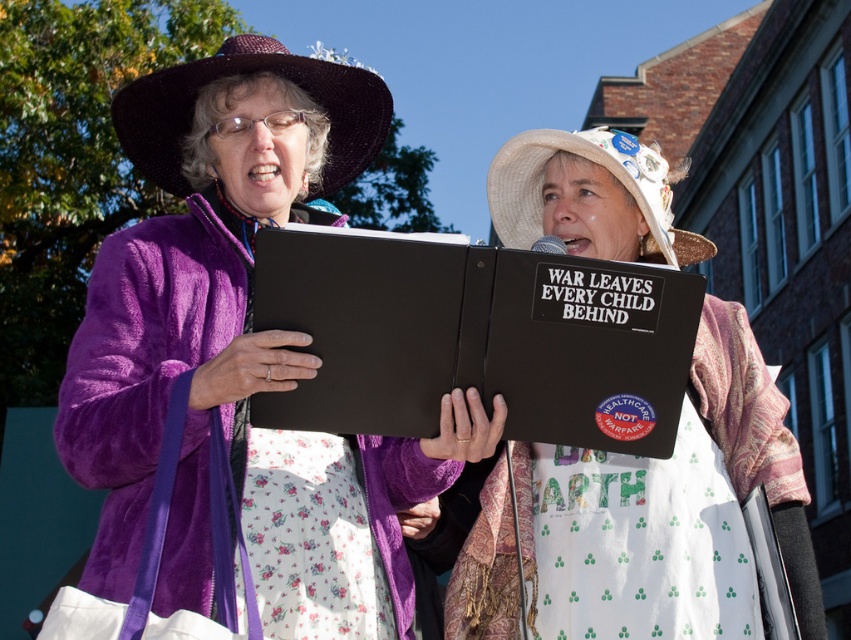
Is purple velvety jacket at center above white fabric apron at center?

Correct, purple velvety jacket at center is located above white fabric apron at center.

Between purple velvety jacket at center and white fabric apron at center, which one is positioned lower?

white fabric apron at center

Where is `purple velvety jacket at center`? The image size is (851, 640). purple velvety jacket at center is located at coordinates (243, 355).

Where is `purple velvety jacket at center`? The image size is (851, 640). purple velvety jacket at center is located at coordinates (243, 355).